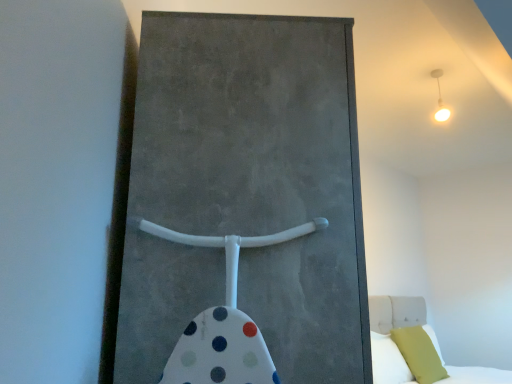
Question: Is point (388, 355) closer or farther from the camera than point (404, 326)?

Choices:
 (A) farther
 (B) closer

Answer: (B)

Question: Considering the positions of green fabric pillow at lower right, which is the 1th pillow in left-to-right order, and white fabric bed at lower right in the image, is green fabric pillow at lower right, which is the 1th pillow in left-to-right order, wider or thinner than white fabric bed at lower right?

Choices:
 (A) thin
 (B) wide

Answer: (A)

Question: Considering the real-world distances, which object is farthest from the concrete textured barn door at center?

Choices:
 (A) white fabric bed at lower right
 (B) white glossy light fixture at upper right
 (C) green fabric pillow at lower right, which is the 1th pillow in left-to-right order
 (D) matte yellow pillow at lower right, which is the 1th pillow from right to left

Answer: (D)

Question: Which is farther from the matte yellow pillow at lower right, which is the 1th pillow from right to left?

Choices:
 (A) white glossy light fixture at upper right
 (B) green fabric pillow at lower right, which is the 2th pillow in right-to-left order
 (C) concrete textured barn door at center
 (D) white fabric bed at lower right

Answer: (C)